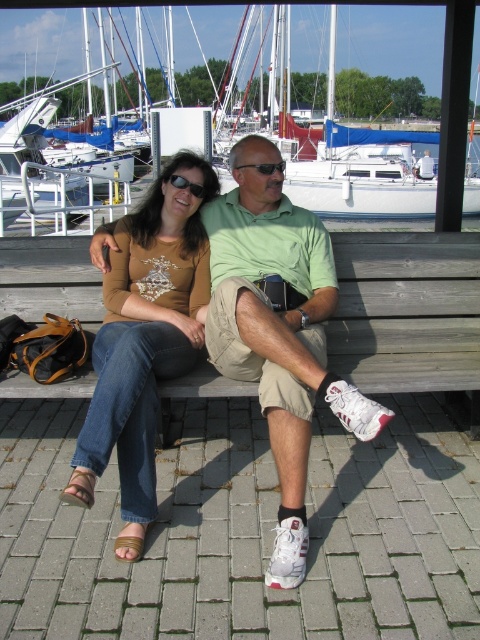
Can you confirm if black plastic sunglasses at upper center is thinner than black plastic sunglasses at center?

Indeed, black plastic sunglasses at upper center has a lesser width compared to black plastic sunglasses at center.

Find the location of a particular element. The height and width of the screenshot is (640, 480). black plastic sunglasses at upper center is located at coordinates (186, 184).

Does point (385, 349) come behind point (144, 221)?

Yes, point (385, 349) is farther from viewer.

Between point (335, 234) and point (122, 554), which one is positioned in front?

Positioned in front is point (122, 554).

Where is `wooden bench at center`? wooden bench at center is located at coordinates (408, 312).

Based on the photo, does matte brown leather shoes at lower center have a greater height compared to black plastic sunglasses at upper center?

Correct, matte brown leather shoes at lower center is much taller as black plastic sunglasses at upper center.

Where is `matte brown leather shoes at lower center`? matte brown leather shoes at lower center is located at coordinates (277, 330).